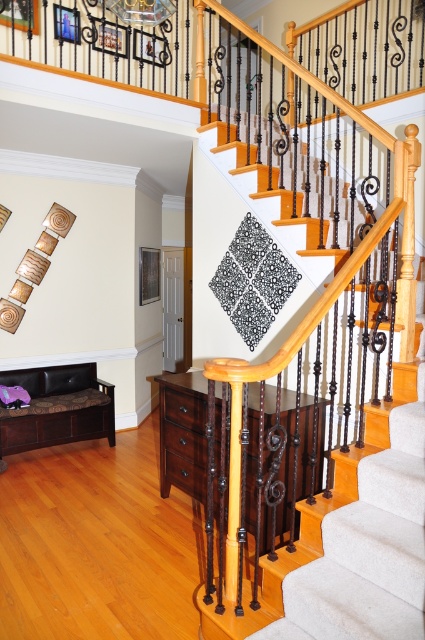
You are standing at the bottom of the white carpeted stairs at upper center and want to sit on the brown leather bench at lower left. Which direction should you move to reach the bench?

You should move to the left because the brown leather bench at lower left is positioned to the left of the white carpeted stairs at upper center.

You are standing at the bottom of the white carpeted stairs at upper center and want to sit on the brown leather bench at lower left. Which direction should you move to reach the bench?

You should move downward because the white carpeted stairs at upper center is positioned over the brown leather bench at lower left, meaning the bench is below the stairs.

You are standing in the room and want to sit down. You see the white carpeted stairs at upper center and the brown leather bench at lower left. Which object is closer to you where you can reach it more easily?

The white carpeted stairs at upper center is closer to the viewer than the brown leather bench at lower left, so you can reach it more easily.